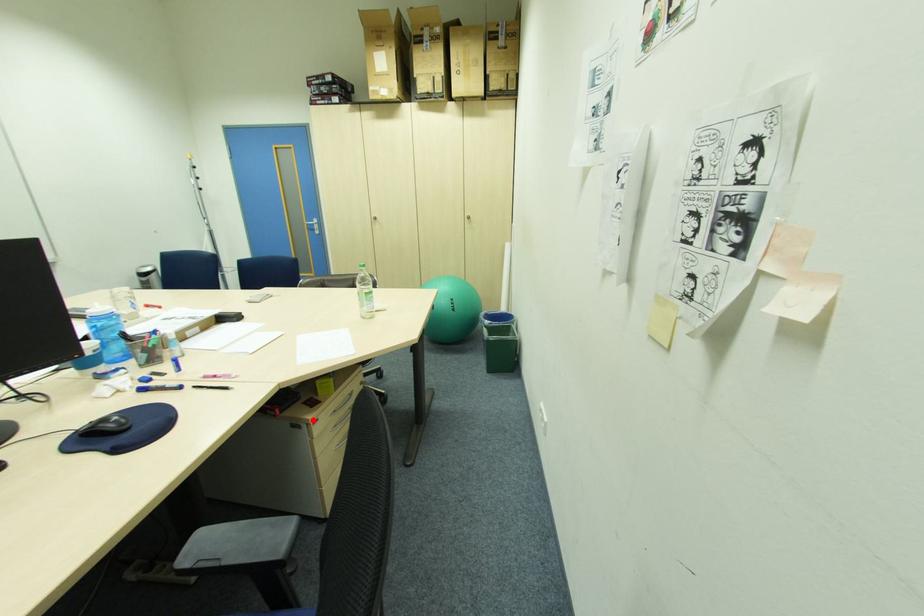
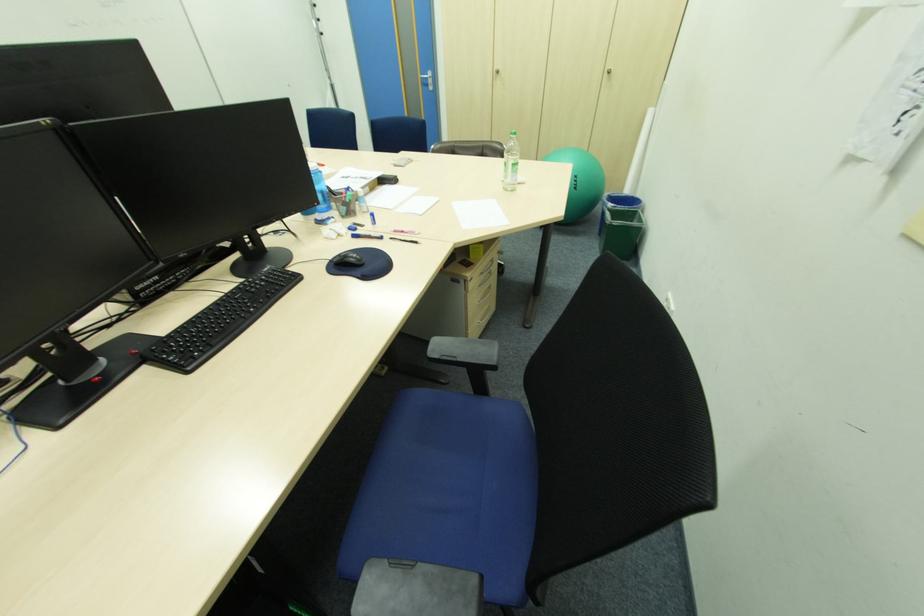
Locate, in the second image, the point that corresponds to the highlighted location in the first image.

(472, 277)